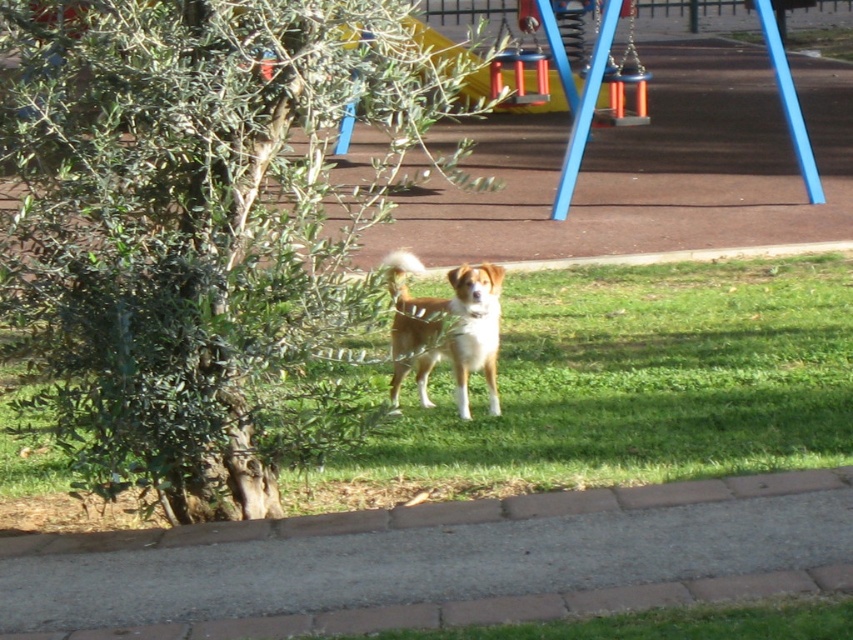
You are standing at the origin point in the park. The paved path is at coordinates ranging from 0.5 to 0.8 on the x and y axes. Is the green grass at center located on the paved path?

The green grass at center is located at coordinates (625, 387), which falls within the paved path area that spans from 0.5 to 0.8 on both axes. Therefore, the green grass at center is on the paved path.